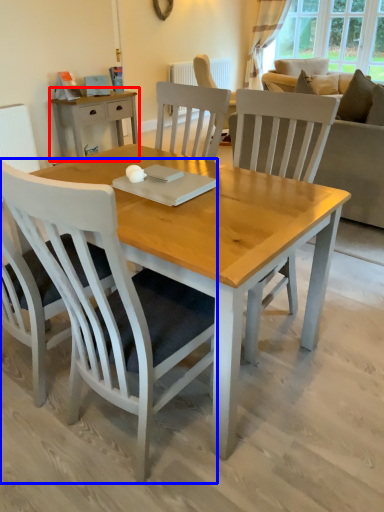
Question: Which of the following is the farthest to the observer, desk (highlighted by a red box) or chair (highlighted by a blue box)?

Choices:
 (A) desk
 (B) chair

Answer: (A)